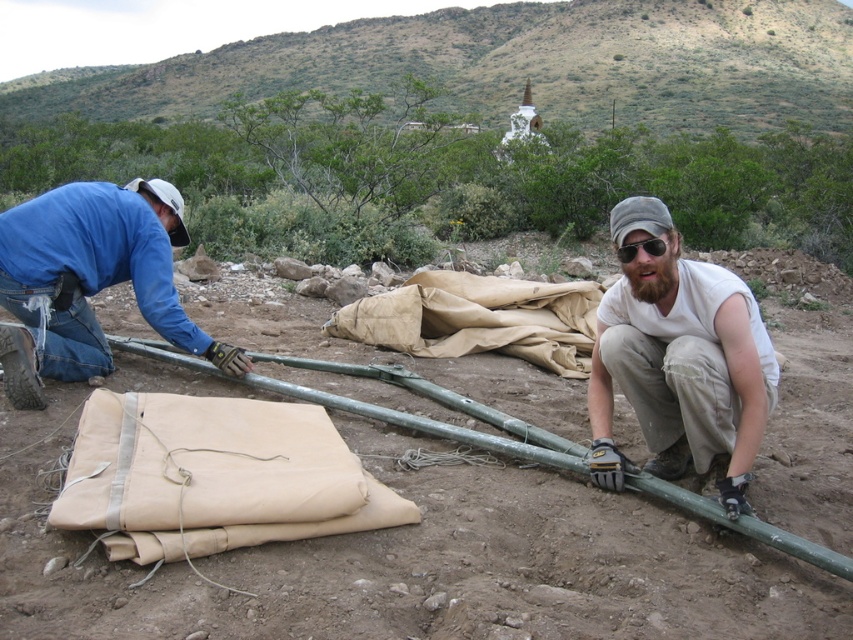
Question: Does white cotton shirt at center appear on the right side of blue denim jeans at left?

Choices:
 (A) yes
 (B) no

Answer: (A)

Question: Is white cotton shirt at center to the left of blue denim jeans at left from the viewer's perspective?

Choices:
 (A) yes
 (B) no

Answer: (B)

Question: Among these points, which one is nearest to the camera?

Choices:
 (A) (671, 301)
 (B) (115, 276)

Answer: (A)

Question: Is white cotton shirt at center further to camera compared to blue denim jeans at left?

Choices:
 (A) no
 (B) yes

Answer: (A)

Question: Among these objects, which one is nearest to the camera?

Choices:
 (A) white cotton shirt at center
 (B) blue denim jeans at left

Answer: (A)